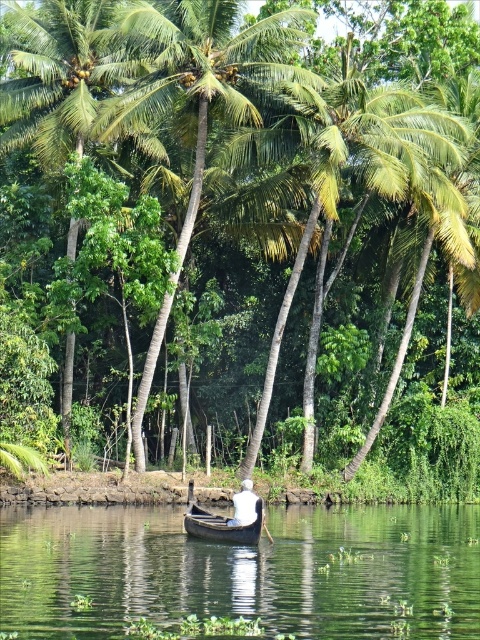
You are standing on a dock and see the green smooth water at center and the black wood boat at center. Which one appears nearer to you?

The green smooth water at center is closer to the viewer than the black wood boat at center.

You are standing on the shore of the lake and see the green leafy palm tree at upper center and the black wood boat at center. Which object is higher in the image?

The green leafy palm tree at upper center is located above the black wood boat at center in the image.